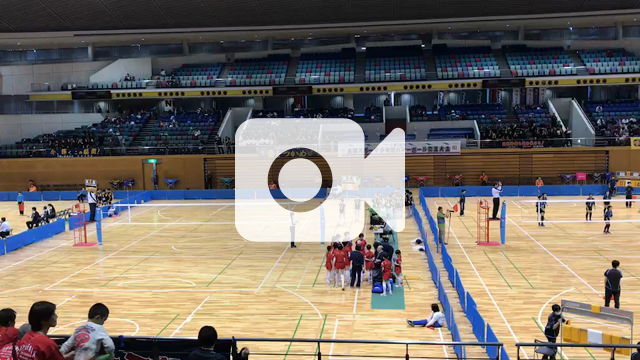
I want to click on door, so click(x=564, y=122).